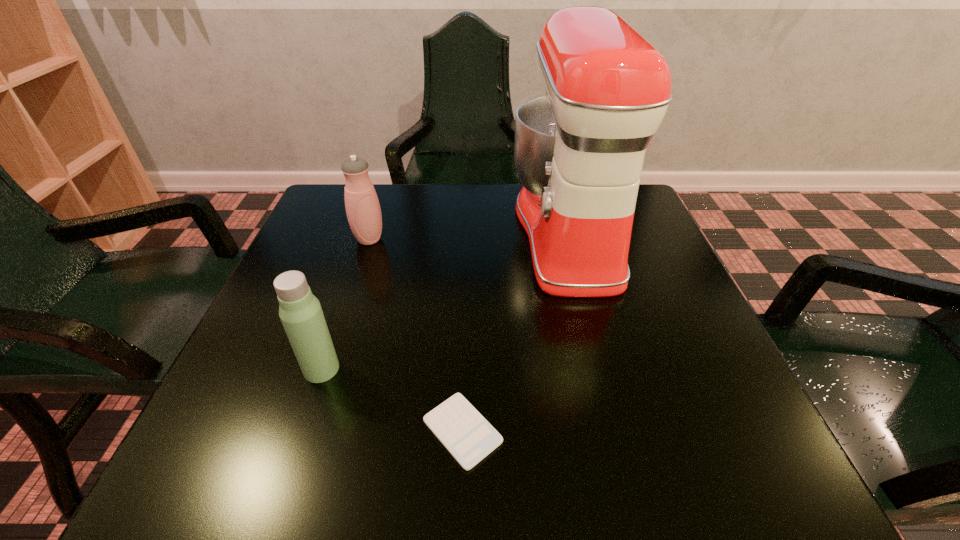
The height and width of the screenshot is (540, 960). Find the location of `the rightmost object`. the rightmost object is located at coordinates (579, 150).

Where is `the tallest object`? the tallest object is located at coordinates (579, 150).

Image resolution: width=960 pixels, height=540 pixels. I want to click on the farther thermos bottle, so click(x=363, y=210).

Where is `the third farthest object`? This screenshot has height=540, width=960. the third farthest object is located at coordinates (300, 311).

Identify the location of calculator. (467, 435).

This screenshot has width=960, height=540. In order to click on the shortest object in this screenshot , I will do `click(467, 435)`.

Where is `free spot located on the front-facing side of the tallest object`? free spot located on the front-facing side of the tallest object is located at coordinates (372, 234).

The height and width of the screenshot is (540, 960). Find the location of `vacant space located 0.140m on the front-facing side of the tallest object`. vacant space located 0.140m on the front-facing side of the tallest object is located at coordinates (452, 234).

You are a GUI agent. You are given a task and a screenshot of the screen. Output one action in this format:
    pyautogui.click(x=<x>, y=<y>)
    Task: Click on the vacant area situated 0.390m on the front-facing side of the tallest object
    This screenshot has height=540, width=960.
    Given the screenshot: What is the action you would take?
    pyautogui.click(x=346, y=234)

Identify the location of free spot located on the right of the farther thermos bottle. (x=545, y=239).